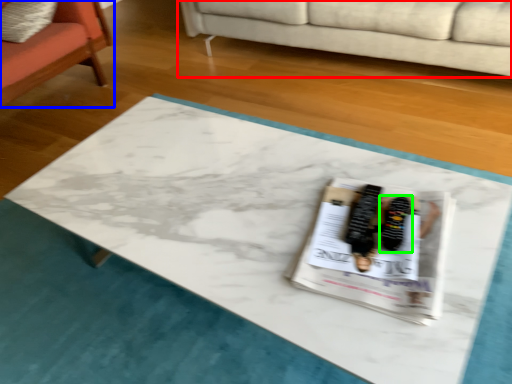
Question: Estimate the real-world distances between objects in this image. Which object is closer to studio couch (highlighted by a red box), chair (highlighted by a blue box) or footwear (highlighted by a green box)?

Choices:
 (A) chair
 (B) footwear

Answer: (A)